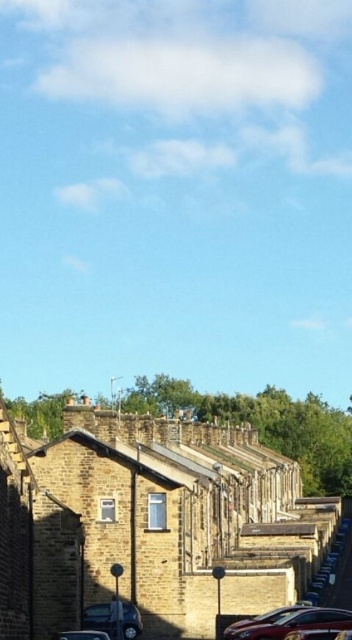
You are a delivery person trying to park your shiny metallic car at lower center. There is a metallic silver car at lower center already parked. Can you park your car in the same spot without overlapping?

The metallic silver car at lower center is above the shiny metallic car at lower center, which means they are parked in different positions. Therefore, you can park your shiny metallic car at lower center in its designated spot without overlapping.

You are standing at the lamppost near the center of the street. Which direction should you walk to reach the metallic silver car at lower center?

The metallic silver car at lower center is located at point coordinates which are to the lower center direction from the lamppost. Since you are at the lamppost, you should walk towards the lower center direction to reach the metallic silver car at lower center.